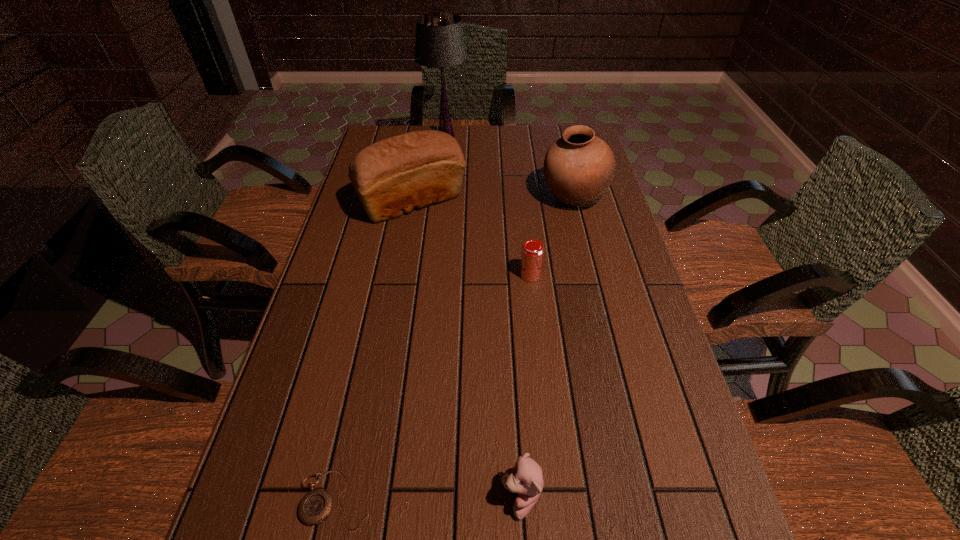
What are the coordinates of `blank area located at the face of the teddy bear` in the screenshot? It's located at (392, 498).

The height and width of the screenshot is (540, 960). In order to click on vacant area situated 0.400m at the face of the teddy bear in this screenshot , I will do click(x=271, y=498).

The height and width of the screenshot is (540, 960). What are the coordinates of `free spot located at the face of the teddy bear` in the screenshot? It's located at (288, 498).

Where is `vacant space located on the right of the beer can`? The height and width of the screenshot is (540, 960). vacant space located on the right of the beer can is located at coordinates (626, 275).

Image resolution: width=960 pixels, height=540 pixels. In order to click on free region located 0.200m on the back of the pocket watch in this screenshot , I will do coord(362,374).

Locate an element on the screen. This screenshot has height=540, width=960. object positioned at the far edge is located at coordinates (440, 43).

At what (x,y) coordinates should I click in order to perform the action: click on bread that is positioned at the left edge. Please return your answer as a coordinate pair (x, y). This screenshot has width=960, height=540. Looking at the image, I should click on click(393, 176).

Locate an element on the screen. The image size is (960, 540). pocket watch that is positioned at the left edge is located at coordinates (315, 507).

The height and width of the screenshot is (540, 960). Identify the location of object located at the right edge. (579, 167).

At what (x,y) coordinates should I click in order to perform the action: click on vacant space at the left edge of the desktop. Please return your answer as a coordinate pair (x, y). This screenshot has width=960, height=540. Looking at the image, I should click on (342, 235).